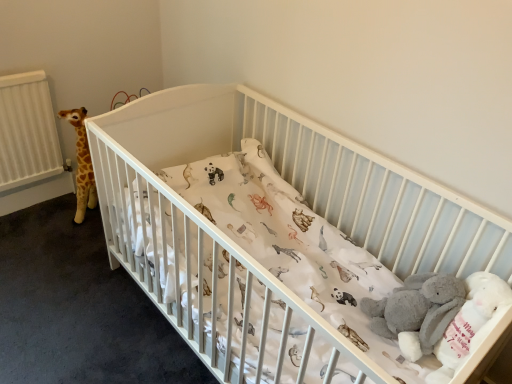
Image resolution: width=512 pixels, height=384 pixels. What do you see at coordinates (291, 182) in the screenshot? I see `white matte crib at center` at bounding box center [291, 182].

Image resolution: width=512 pixels, height=384 pixels. In order to click on white matte crib at center in this screenshot , I will do `click(291, 182)`.

What do you see at coordinates (417, 308) in the screenshot? This screenshot has width=512, height=384. I see `gray plush baby elephant at lower right` at bounding box center [417, 308].

Locate an element on the screen. This screenshot has height=384, width=512. gray plush baby elephant at lower right is located at coordinates (417, 308).

Locate an element on the screen. white matte crib at center is located at coordinates (291, 182).

Considering the positions of objects white matte crib at center and gray plush baby elephant at lower right in the image provided, who is more to the left, white matte crib at center or gray plush baby elephant at lower right?

Positioned to the left is white matte crib at center.

Considering the positions of objects white matte crib at center and gray plush baby elephant at lower right in the image provided, who is in front, white matte crib at center or gray plush baby elephant at lower right?

white matte crib at center.

Considering the positions of point (173, 231) and point (416, 322), is point (173, 231) closer or farther from the camera than point (416, 322)?

Point (173, 231) appears to be farther away from the viewer than point (416, 322).

From the image's perspective, is white matte crib at center located above or below gray plush baby elephant at lower right?

Based on their image positions, white matte crib at center is located above gray plush baby elephant at lower right.

From a real-world perspective, between white matte crib at center and gray plush baby elephant at lower right, who is vertically lower?

From a 3D spatial view, white matte crib at center is below.

Between white matte crib at center and gray plush baby elephant at lower right, which one has larger width?

With larger width is white matte crib at center.

Considering the relative sizes of white matte crib at center and gray plush baby elephant at lower right in the image provided, is white matte crib at center shorter than gray plush baby elephant at lower right?

No.

Considering the sizes of white matte crib at center and gray plush baby elephant at lower right in the image, is white matte crib at center bigger or smaller than gray plush baby elephant at lower right?

Result: Considering their sizes, white matte crib at center takes up more space than gray plush baby elephant at lower right.

Do you think white matte crib at center is within gray plush baby elephant at lower right, or outside of it?

The correct answer is: outside.

In the scene shown: Are white matte crib at center and gray plush baby elephant at lower right located far from each other?

No, white matte crib at center is not far from gray plush baby elephant at lower right.

Could you tell me if white matte crib at center is facing gray plush baby elephant at lower right?

No, white matte crib at center is not oriented towards gray plush baby elephant at lower right.

What are the coordinates of `baby elephant behind the white matte crib at center` in the screenshot? It's located at point(417,308).

In the image, is gray plush baby elephant at lower right on the left side or the right side of white matte crib at center?

gray plush baby elephant at lower right is positioned on white matte crib at center's right side.

From the picture: Does gray plush baby elephant at lower right come in front of white matte crib at center?

No, gray plush baby elephant at lower right is further to the viewer.

Consider the image. Which is nearer, (381, 330) or (488, 264)?

Point (381, 330) appears to be farther away from the viewer than point (488, 264).

From the image's perspective, is gray plush baby elephant at lower right on white matte crib at center?

Incorrect, from the image's perspective, gray plush baby elephant at lower right is lower than white matte crib at center.

From a real-world perspective, is gray plush baby elephant at lower right positioned above or below white matte crib at center?

Clearly, from a real-world perspective, gray plush baby elephant at lower right is above white matte crib at center.

Is gray plush baby elephant at lower right wider than white matte crib at center?

Incorrect, the width of gray plush baby elephant at lower right does not surpass that of white matte crib at center.

In the scene shown: Is gray plush baby elephant at lower right taller or shorter than white matte crib at center?

gray plush baby elephant at lower right is shorter than white matte crib at center.

Is gray plush baby elephant at lower right smaller than white matte crib at center?

Indeed, gray plush baby elephant at lower right has a smaller size compared to white matte crib at center.

Is gray plush baby elephant at lower right not within white matte crib at center?

No, gray plush baby elephant at lower right is inside white matte crib at center's boundary.

Are gray plush baby elephant at lower right and white matte crib at center beside each other?

gray plush baby elephant at lower right is not next to white matte crib at center, and they're not touching.

Is gray plush baby elephant at lower right positioned with its back to white matte crib at center?

Yes.

Can you tell me how much gray plush baby elephant at lower right and white matte crib at center differ in facing direction?

There is a 13-degree angle between the facing directions of gray plush baby elephant at lower right and white matte crib at center.

Where is `baby elephant that appears behind the white matte crib at center`? The image size is (512, 384). baby elephant that appears behind the white matte crib at center is located at coordinates (417, 308).

At what (x,y) coordinates should I click in order to perform the action: click on infant bed in front of the gray plush baby elephant at lower right. Please return your answer as a coordinate pair (x, y). The height and width of the screenshot is (384, 512). Looking at the image, I should click on (291, 182).

Locate an element on the screen. baby elephant positioned vertically above the white matte crib at center (from a real-world perspective) is located at coordinates (417, 308).